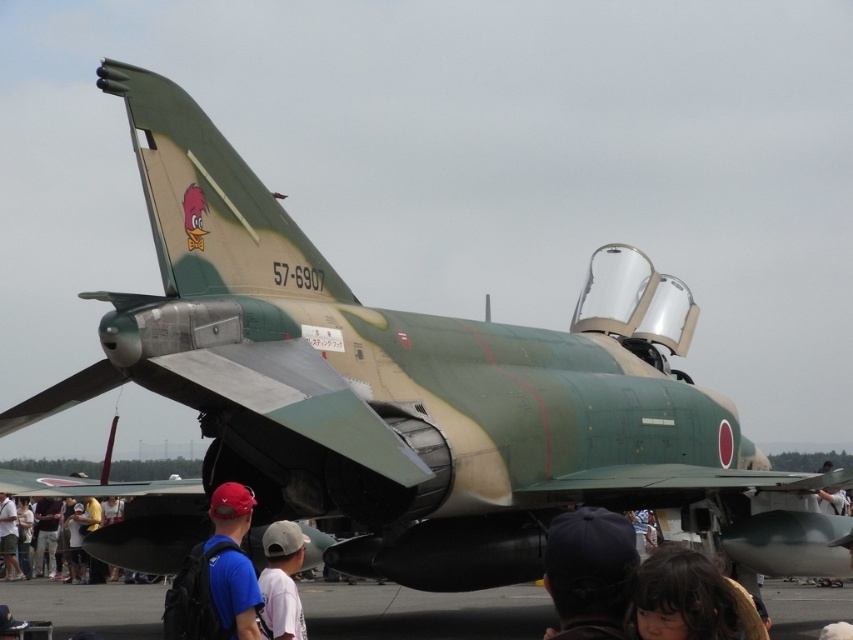
You are a photographer at the airshow and want to take a photo of the cockpit canopy. You notice the dark blue fabric cap at lower center and the dark brown hair at lower center. Which object is positioned higher in the image?

The dark blue fabric cap at lower center is located above the dark brown hair at lower center, so it is positioned higher in the image.